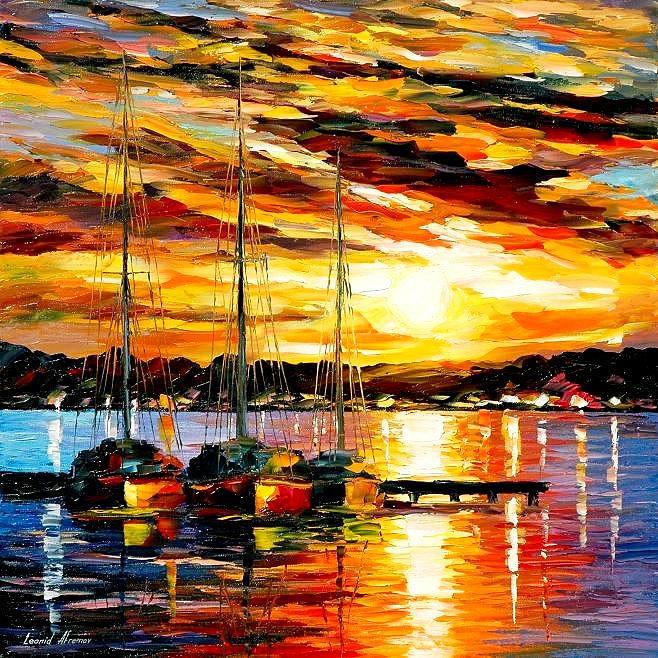
The width and height of the screenshot is (658, 658). Identify the location of painting. (465, 388).